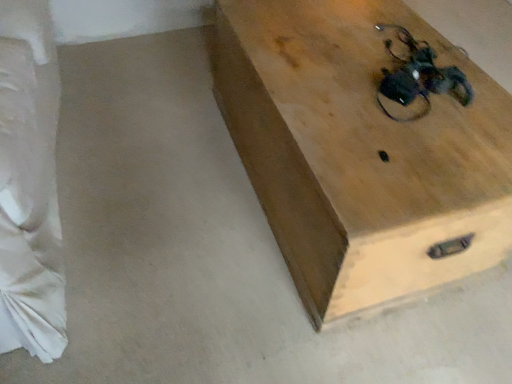
The width and height of the screenshot is (512, 384). Identify the location of empty space that is ontop of natural wood chest at upper right (from a real-world perspective). (397, 103).